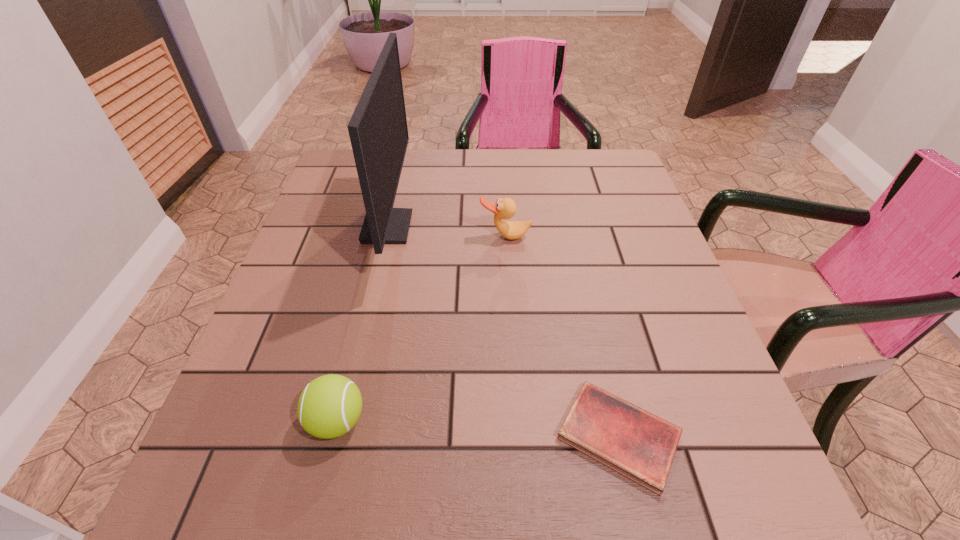
Locate an element on the screen. This screenshot has height=540, width=960. empty space between the second object from right to left and the tennis ball is located at coordinates (421, 329).

Where is `free point between the computer monitor and the tennis ball`? Image resolution: width=960 pixels, height=540 pixels. free point between the computer monitor and the tennis ball is located at coordinates pos(362,324).

Where is `empty space that is in between the duck and the rightmost object`? Image resolution: width=960 pixels, height=540 pixels. empty space that is in between the duck and the rightmost object is located at coordinates (562, 336).

Locate which object is the second closest to the shortest object. Please provide its 2D coordinates. Your answer should be formatted as a tuple, i.e. [(x, y)], where the tuple contains the x and y coordinates of a point satisfying the conditions above.

[(378, 131)]

Identify which object is the third closest to the third object from left to right. Please provide its 2D coordinates. Your answer should be formatted as a tuple, i.e. [(x, y)], where the tuple contains the x and y coordinates of a point satisfying the conditions above.

[(329, 406)]

Where is `free space that satisfies the following two spatial constraints: 1. on the back side of the diary; 2. on the front-facing side of the computer monitor`? The height and width of the screenshot is (540, 960). free space that satisfies the following two spatial constraints: 1. on the back side of the diary; 2. on the front-facing side of the computer monitor is located at coordinates tap(570, 227).

Find the location of `vacant space that satisfies the following two spatial constraints: 1. on the front-facing side of the computer monitor; 2. on the left side of the shortest object`. vacant space that satisfies the following two spatial constraints: 1. on the front-facing side of the computer monitor; 2. on the left side of the shortest object is located at coordinates (338, 435).

The image size is (960, 540). In order to click on free space that satisfies the following two spatial constraints: 1. on the front-facing side of the tallest object; 2. on the left side of the diary in this screenshot , I will do `click(338, 435)`.

This screenshot has height=540, width=960. I want to click on free space that satisfies the following two spatial constraints: 1. on the back side of the diary; 2. on the front-facing side of the computer monitor, so click(570, 227).

Where is `free spot that satisfies the following two spatial constraints: 1. on the back side of the diary; 2. on the front-facing side of the computer monitor`? This screenshot has height=540, width=960. free spot that satisfies the following two spatial constraints: 1. on the back side of the diary; 2. on the front-facing side of the computer monitor is located at coordinates pyautogui.click(x=570, y=227).